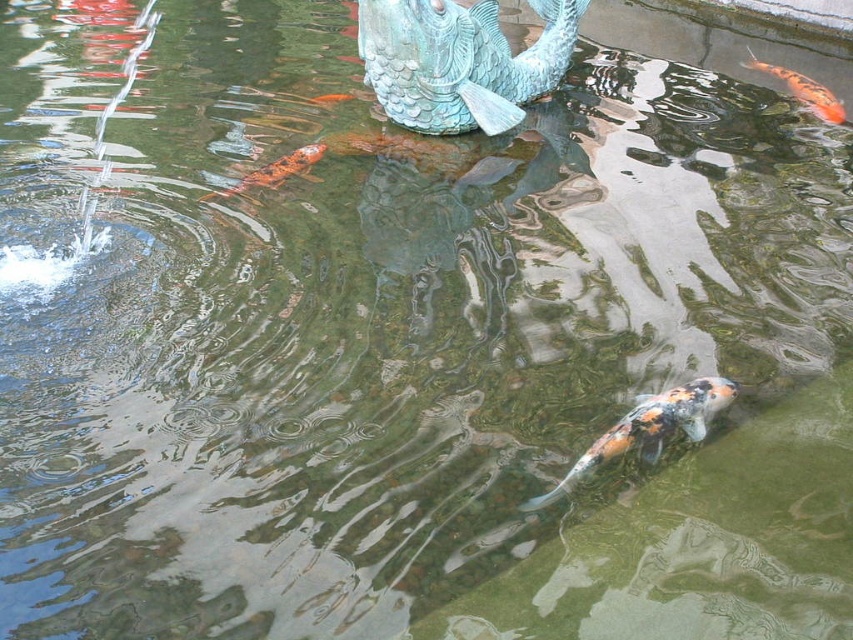
You are a GUI agent. You are given a task and a screenshot of the screen. Output one action in this format:
    pyautogui.click(x=<x>, y=<y>)
    Task: Click on the orange shiny fish at center
    
    Given the screenshot: What is the action you would take?
    pyautogui.click(x=274, y=170)

Based on the photo, who is higher up, orange shiny fish at center or shiny orange fish at center?

shiny orange fish at center is above.

Is point (265, 180) farther from camera compared to point (328, 100)?

No, it is in front of (328, 100).

You are a GUI agent. You are given a task and a screenshot of the screen. Output one action in this format:
    pyautogui.click(x=<x>, y=<y>)
    Task: Click on the orange shiny fish at center
    This screenshot has width=853, height=640.
    Given the screenshot: What is the action you would take?
    pyautogui.click(x=274, y=170)

Which of these two, orange shiny fish at upper right or shiny orange fish at center, stands taller?

Standing taller between the two is orange shiny fish at upper right.

Can you confirm if orange shiny fish at upper right is thinner than shiny orange fish at center?

No, orange shiny fish at upper right is not thinner than shiny orange fish at center.

Which is behind, point (747, 65) or point (334, 99)?

Point (747, 65)

Where is `orange shiny fish at upper right`? orange shiny fish at upper right is located at coordinates (804, 90).

From the picture: Is speckled orange and white fish at center closer to camera compared to orange shiny fish at center?

Yes, it is in front of orange shiny fish at center.

What do you see at coordinates (648, 428) in the screenshot? I see `speckled orange and white fish at center` at bounding box center [648, 428].

This screenshot has height=640, width=853. What do you see at coordinates (648, 428) in the screenshot? I see `speckled orange and white fish at center` at bounding box center [648, 428].

This screenshot has height=640, width=853. In order to click on speckled orange and white fish at center in this screenshot , I will do `click(648, 428)`.